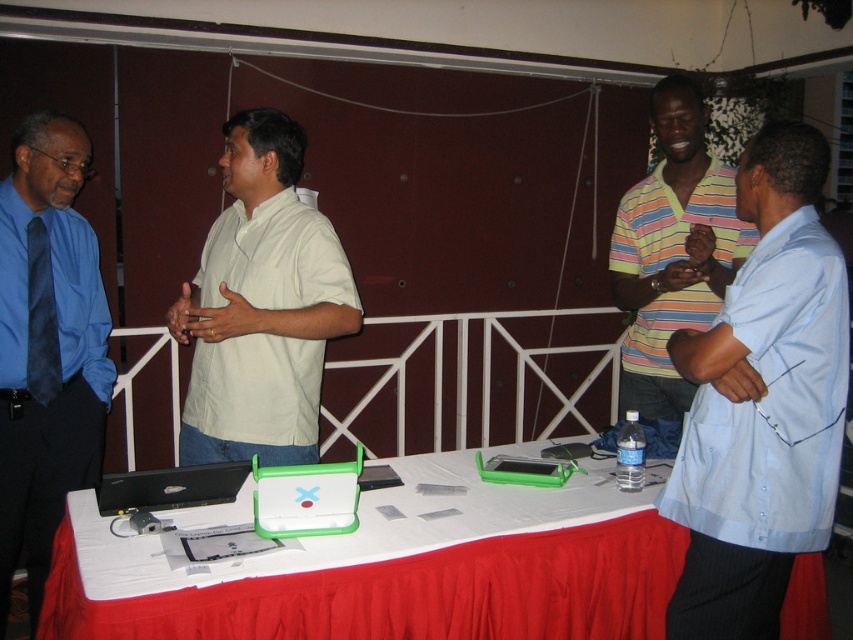
Find the location of a particular element. blue satin shirt at left is located at coordinates (47, 348).

Who is lower down, blue satin shirt at left or black matte laptop at lower left?

black matte laptop at lower left

The image size is (853, 640). Describe the element at coordinates (47, 348) in the screenshot. I see `blue satin shirt at left` at that location.

Locate an element on the screen. blue satin shirt at left is located at coordinates (47, 348).

Can you confirm if light beige cotton shirt at center is shorter than striped cotton shirt at center?

Yes.

Find the location of `light beige cotton shirt at center`. light beige cotton shirt at center is located at coordinates pos(260,305).

Find the location of `light beige cotton shirt at center`. light beige cotton shirt at center is located at coordinates click(260, 305).

Can you confirm if red fabric tablecloth at lower center is positioned to the left of light beige cotton shirt at center?

Incorrect, red fabric tablecloth at lower center is not on the left side of light beige cotton shirt at center.

Is point (570, 536) positioned behind point (241, 252)?

No, it is not.

Does point (177, 602) come closer to viewer compared to point (268, 209)?

Yes, it is in front of point (268, 209).

The width and height of the screenshot is (853, 640). What are the coordinates of `red fabric tablecloth at lower center` in the screenshot? It's located at (392, 570).